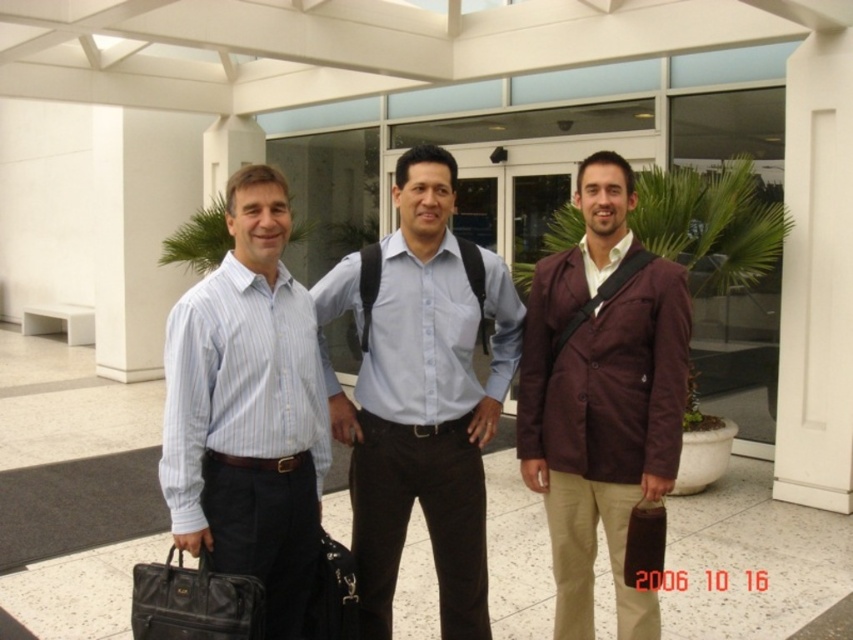
Question: Where is light blue shirt at center located in relation to maroon textured blazer at center in the image?

Choices:
 (A) above
 (B) below

Answer: (A)

Question: Can you confirm if maroon textured blazer at center is wider than black leather briefcase at lower left?

Choices:
 (A) no
 (B) yes

Answer: (B)

Question: Is light blue striped shirt at center positioned behind brown leather briefcase at center?

Choices:
 (A) yes
 (B) no

Answer: (B)

Question: Considering the real-world distances, which object is farthest from the light blue shirt at center?

Choices:
 (A) light blue striped shirt at center
 (B) black leather briefcase at lower left
 (C) brown leather briefcase at center
 (D) maroon textured blazer at center

Answer: (B)

Question: Which point is farther to the camera?

Choices:
 (A) black leather briefcase at lower left
 (B) maroon textured blazer at center
 (C) light blue shirt at center

Answer: (C)

Question: Based on their relative distances, which object is farther from the black leather briefcase at lower left?

Choices:
 (A) brown leather briefcase at center
 (B) light blue striped shirt at center
 (C) light blue shirt at center
 (D) maroon textured blazer at center

Answer: (D)